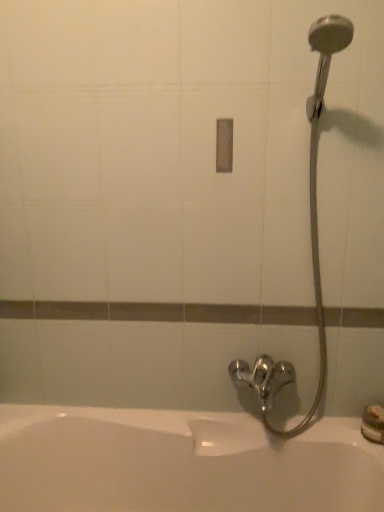
What is the approximate height of white glossy bathtub at center?

white glossy bathtub at center is 19.35 inches tall.

Locate an element on the screen. The width and height of the screenshot is (384, 512). white glossy bathtub at center is located at coordinates (179, 464).

Image resolution: width=384 pixels, height=512 pixels. Describe the element at coordinates (179, 464) in the screenshot. I see `white glossy bathtub at center` at that location.

Locate an element on the screen. This screenshot has height=512, width=384. white glossy bathtub at center is located at coordinates (179, 464).